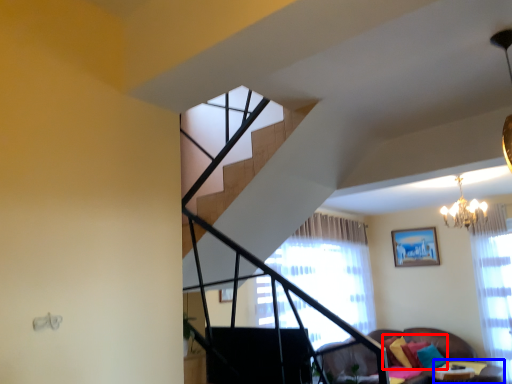
Question: Which object is further to the camera taking this photo, pillow (highlighted by a red box) or table (highlighted by a blue box)?

Choices:
 (A) pillow
 (B) table

Answer: (A)